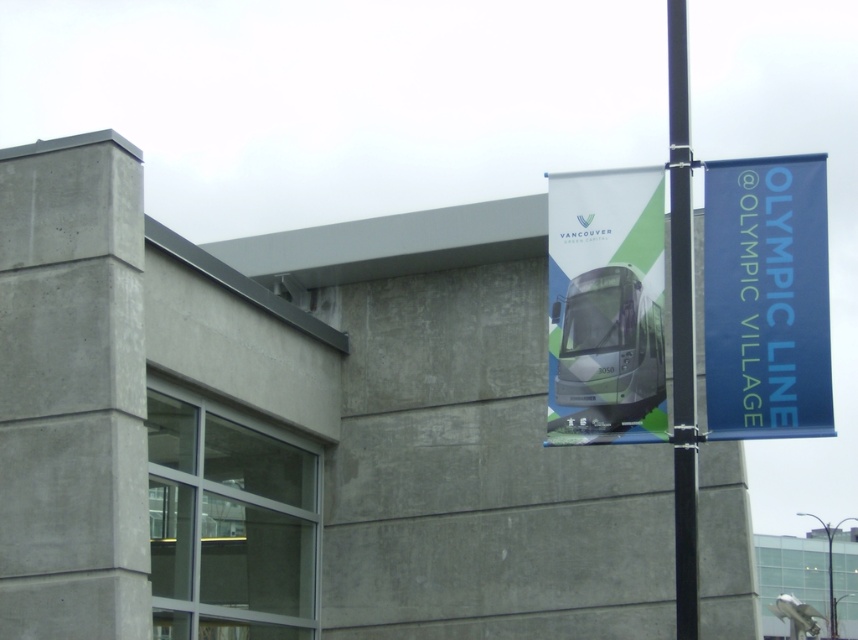
Can you confirm if blue fabric banner at upper right is thinner than black metal pole at right?

Indeed, blue fabric banner at upper right has a lesser width compared to black metal pole at right.

Is point (717, 228) positioned behind point (675, 161)?

Yes, point (717, 228) is behind point (675, 161).

You are a GUI agent. You are given a task and a screenshot of the screen. Output one action in this format:
    pyautogui.click(x=<x>, y=<y>)
    Task: Click on the blue fabric banner at upper right
    
    Given the screenshot: What is the action you would take?
    pyautogui.click(x=766, y=298)

Does point (557, 401) come behind point (687, 308)?

Yes.

Who is lower down, green matte bus at center or black metal pole at right?

Positioned lower is green matte bus at center.

Who is more distant from viewer, (565, 296) or (681, 515)?

The point (565, 296) is more distant.

The height and width of the screenshot is (640, 858). What are the coordinates of `green matte bus at center` in the screenshot? It's located at (x=607, y=352).

Based on the photo, between blue fabric banner at upper right and green matte bus at center, which one appears on the right side from the viewer's perspective?

blue fabric banner at upper right is more to the right.

Is blue fabric banner at upper right in front of green matte bus at center?

Yes.

The image size is (858, 640). Identify the location of blue fabric banner at upper right. (766, 298).